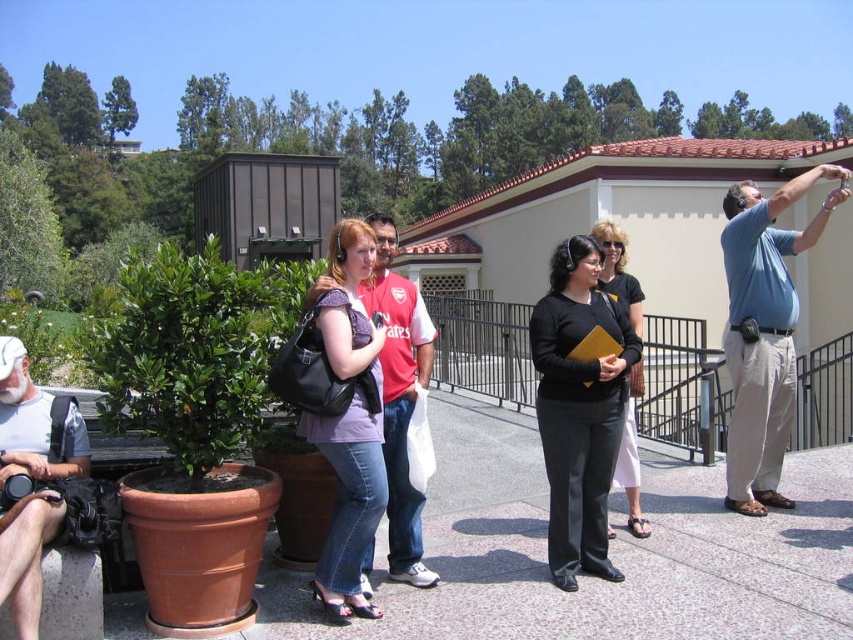
You are standing at the origin of the coordinate system in the image. You want to walk to the point labeled point [601,237]. However, there is an obstacle at point [410,541]. Will you encounter the obstacle before reaching your destination?

Yes, you will encounter the obstacle at point [410,541] before reaching point [601,237] because point [410,541] is in front of point [601,237].

You are a photographer trying to capture a group photo of the people in the scene. You need to ensure that the matte red shirt at center and the black leather pants at center are clearly visible in the photo. Based on their sizes, which object should you focus on to ensure both are in focus?

The matte red shirt at center is thinner than the black leather pants at center, so focusing on the black leather pants at center will ensure both are in focus since it is larger and easier to capture clearly.